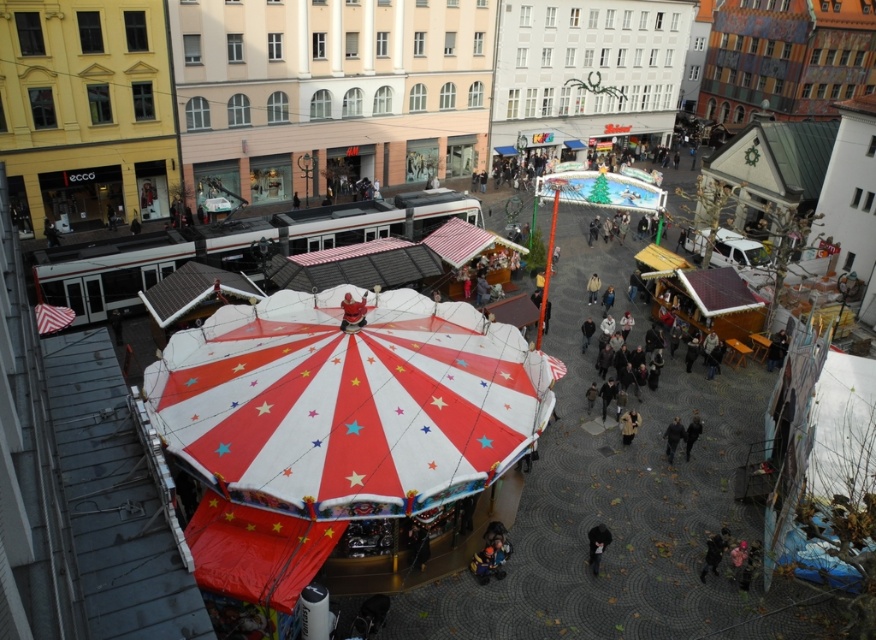
Is matte red coat at center behind dark gray coat at center?

Yes, it is behind dark gray coat at center.

Which is more to the left, matte red coat at center or dark gray coat at center?

Positioned to the left is matte red coat at center.

Between point (343, 308) and point (594, 564), which one is positioned in front?

Point (594, 564) is in front.

The height and width of the screenshot is (640, 876). I want to click on matte red coat at center, so click(352, 312).

Can you confirm if red and white striped umbrella at center is shorter than matte red coat at center?

No, red and white striped umbrella at center is not shorter than matte red coat at center.

From the picture: Who is more forward, (417,392) or (357,320)?

Point (417,392) is in front.

Locate an element on the screen. The height and width of the screenshot is (640, 876). red and white striped umbrella at center is located at coordinates (350, 403).

Can you confirm if red and white striped umbrella at center is positioned to the right of dark gray jacket at center?

In fact, red and white striped umbrella at center is to the left of dark gray jacket at center.

Is point (528, 371) positioned in front of point (665, 456)?

That is True.

Measure the distance between point (362, 474) and camera.

A distance of 72.83 feet exists between point (362, 474) and camera.

The width and height of the screenshot is (876, 640). What are the coordinates of `red and white striped umbrella at center` in the screenshot? It's located at (350, 403).